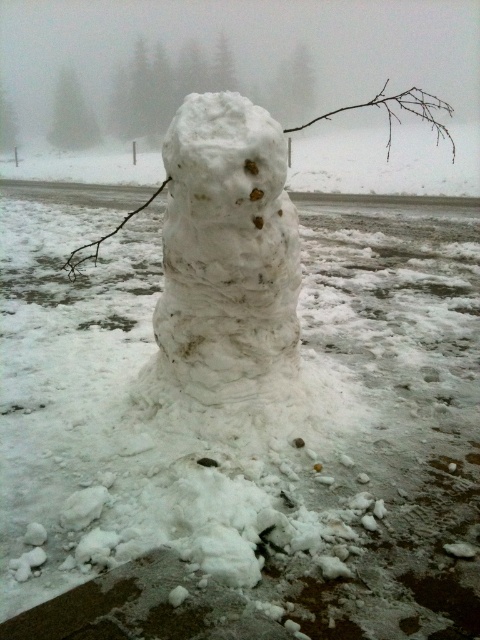
Between white fluffy snowman at center and brown twig at center, which one has less height?

Standing shorter between the two is white fluffy snowman at center.

Where is `white fluffy snowman at center`? white fluffy snowman at center is located at coordinates (227, 256).

Can you confirm if white fluffy snowman at center is positioned below white snow at center?

Indeed, white fluffy snowman at center is positioned under white snow at center.

Does point (216, 388) lie behind point (84, 248)?

No, it is not.

Does point (245, 220) come behind point (432, 102)?

That is False.

At what (x,y) coordinates should I click in order to perform the action: click on white fluffy snowman at center. Please return your answer as a coordinate pair (x, y). This screenshot has height=640, width=480. Looking at the image, I should click on (227, 256).

Which is in front, point (380, 106) or point (69, 262)?

Positioned in front is point (69, 262).

Between white snow at center and brown twig at center, which one has more height?

Standing taller between the two is white snow at center.

Where is `white snow at center`? This screenshot has width=480, height=640. white snow at center is located at coordinates (396, 113).